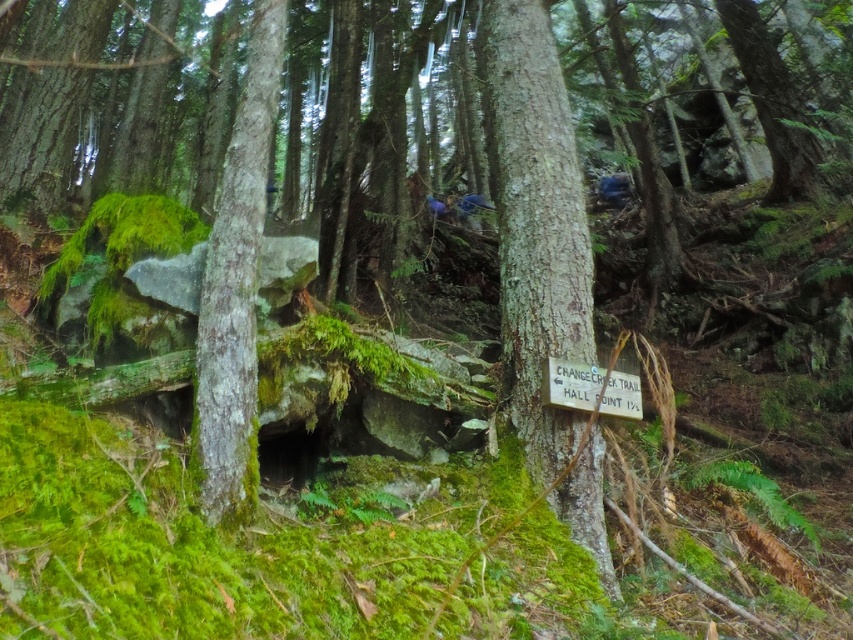
You are a hiker navigating through the forest and want to touch both the smooth bark tree trunk at center and the green mossy bark at center. Which one should you reach for first?

You should reach for the smooth bark tree trunk at center first because it is closer to you than the green mossy bark at center.

You are standing at the origin point in the forest scene. Where is the smooth bark tree trunk at center located in terms of coordinates?

The smooth bark tree trunk at center is located at coordinates point (538, 228).

You are a hiker trying to identify landmarks in the forest. You see the smooth bark tree trunk at center and the green mossy bark at center. Which of these two landmarks is taller?

The smooth bark tree trunk at center is taller than the green mossy bark at center.